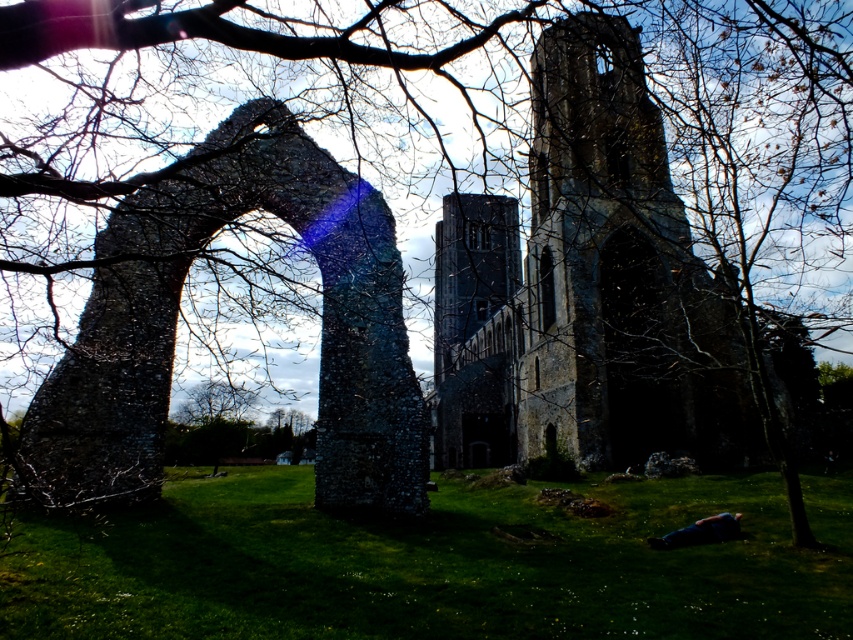
Question: Which point appears closest to the camera in this image?

Choices:
 (A) (663, 432)
 (B) (318, 253)

Answer: (B)

Question: Does rusty stone church at center lie behind rustic stone arch at left?

Choices:
 (A) yes
 (B) no

Answer: (A)

Question: Which of the following is the closest to the observer?

Choices:
 (A) rustic stone arch at left
 (B) rusty stone church at center

Answer: (A)

Question: Is rusty stone church at center to the left of rustic stone arch at left from the viewer's perspective?

Choices:
 (A) yes
 (B) no

Answer: (B)

Question: Which of the following is the closest to the observer?

Choices:
 (A) [x=691, y=320]
 (B) [x=374, y=412]

Answer: (B)

Question: Can you confirm if rusty stone church at center is bigger than rustic stone arch at left?

Choices:
 (A) yes
 (B) no

Answer: (A)